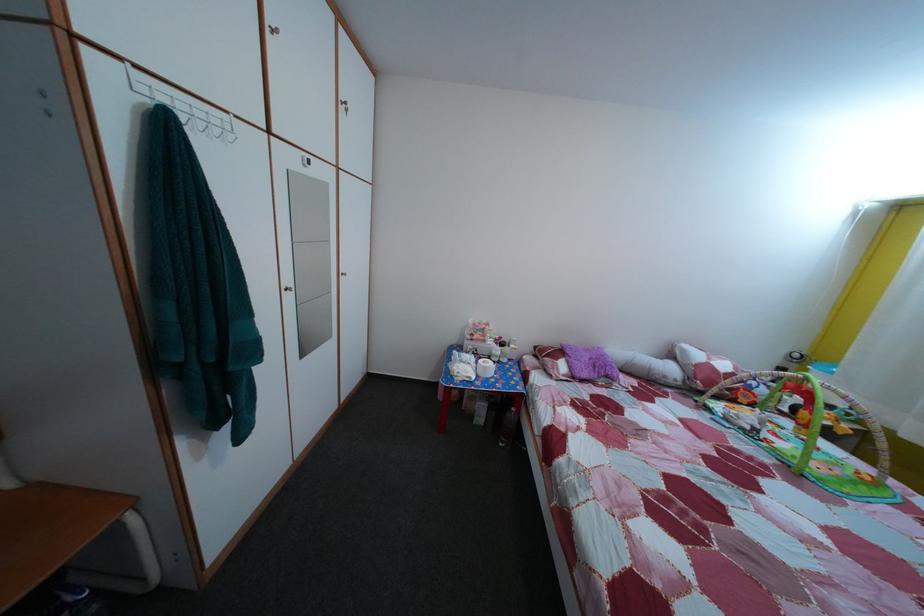
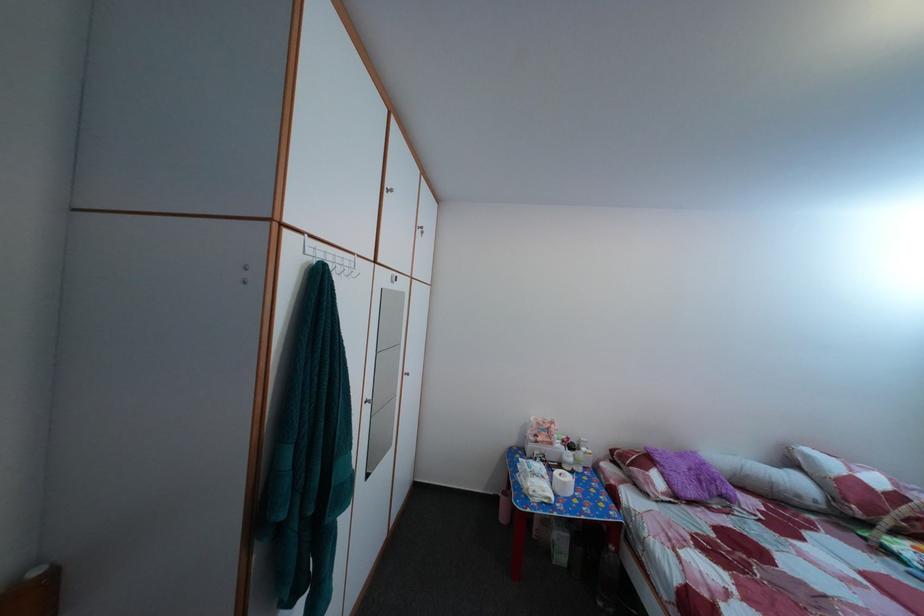
The point at (693,358) is marked in the first image. Where is the corresponding point in the second image?

(817, 464)